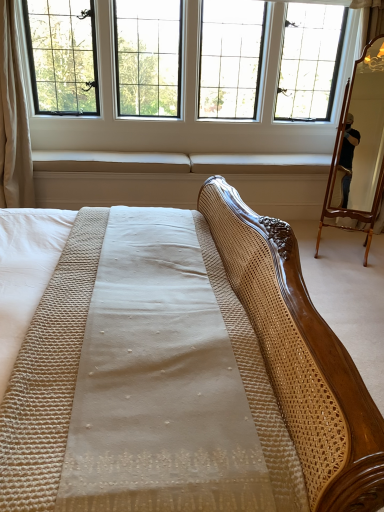
Where is `clear glass window at upper center`? Image resolution: width=384 pixels, height=512 pixels. clear glass window at upper center is located at coordinates (249, 68).

You are a GUI agent. You are given a task and a screenshot of the screen. Output one action in this format:
    pyautogui.click(x=<x>, y=<y>)
    Task: Click on the clear glass window at upper center
    
    Given the screenshot: What is the action you would take?
    pyautogui.click(x=249, y=68)

Consider the image. In terms of height, does white fabric curtain at left look taller or shorter compared to clear glass window at upper center?

white fabric curtain at left is taller than clear glass window at upper center.

From a real-world perspective, is white fabric curtain at left on clear glass window at upper center?

No, from a real-world perspective, white fabric curtain at left is not on top of clear glass window at upper center.

Does white fabric curtain at left have a greater width compared to clear glass window at upper center?

No, white fabric curtain at left is not wider than clear glass window at upper center.

Can you tell me how much white fabric curtain at left and clear glass window at upper center differ in facing direction?

white fabric curtain at left and clear glass window at upper center are facing 0.506 degrees away from each other.

Based on the photo, between wooden mirror at right and clear glass window at upper center, which one has less height?

Standing shorter between the two is clear glass window at upper center.

Who is bigger, wooden mirror at right or clear glass window at upper center?

Bigger between the two is clear glass window at upper center.

What's the angular difference between wooden mirror at right and clear glass window at upper center's facing directions?

The angle between the facing direction of wooden mirror at right and the facing direction of clear glass window at upper center is 25.1 degrees.

Based on the photo, could clear glass window at upper center be considered to be inside wooden mirror at right?

That's incorrect, clear glass window at upper center is not inside wooden mirror at right.

Where is `mirror in front of the white fabric curtain at left`? Image resolution: width=384 pixels, height=512 pixels. mirror in front of the white fabric curtain at left is located at coordinates (360, 146).

In terms of width, does wooden mirror at right look wider or thinner when compared to white fabric curtain at left?

Clearly, wooden mirror at right has less width compared to white fabric curtain at left.

Is wooden mirror at right bigger than white fabric curtain at left?

Actually, wooden mirror at right might be smaller than white fabric curtain at left.

Between point (331, 164) and point (13, 88), which one is positioned behind?

The point (331, 164) is farther from the camera.

Is clear glass window at upper center oriented towards white fabric curtain at left?

Yes, clear glass window at upper center is facing white fabric curtain at left.

Considering the points (247, 32) and (17, 197), which point is behind, point (247, 32) or point (17, 197)?

The point (247, 32) is behind.

Find the location of `curtain located underneath the clear glass window at upper center (from a real-world perspective)`. curtain located underneath the clear glass window at upper center (from a real-world perspective) is located at coordinates (13, 119).

Is clear glass window at upper center to the left or to the right of white fabric curtain at left in the image?

Clearly, clear glass window at upper center is on the right of white fabric curtain at left in the image.

Identify the location of mirror on the right of clear glass window at upper center. (360, 146).

Considering the sizes of objects clear glass window at upper center and wooden mirror at right in the image provided, who is bigger, clear glass window at upper center or wooden mirror at right?

Bigger between the two is clear glass window at upper center.

Who is taller, clear glass window at upper center or wooden mirror at right?

Standing taller between the two is wooden mirror at right.

Between point (14, 110) and point (378, 42), which one is positioned in front?

The point (378, 42) is closer.

Is the surface of white fabric curtain at left in direct contact with wooden mirror at right?

No, white fabric curtain at left is not with wooden mirror at right.

From a real-world perspective, which object rests below the other?

From a 3D spatial view, wooden mirror at right is below.

Consider the image. Could you tell me if white fabric curtain at left is turned towards wooden mirror at right?

No, white fabric curtain at left is not turned towards wooden mirror at right.

The height and width of the screenshot is (512, 384). Identify the location of curtain below the clear glass window at upper center (from a real-world perspective). (13, 119).

Identify the location of mirror in front of the clear glass window at upper center. (360, 146).

Considering their positions, is wooden mirror at right positioned closer to white fabric curtain at left than clear glass window at upper center?

clear glass window at upper center is closer to white fabric curtain at left.

Looking at the image, which one is located closer to clear glass window at upper center, wooden mirror at right or white fabric curtain at left?

Based on the image, white fabric curtain at left appears to be nearer to clear glass window at upper center.

Which object lies further to the anchor point clear glass window at upper center, white fabric curtain at left or wooden mirror at right?

wooden mirror at right.

Which object lies further to the anchor point wooden mirror at right, white fabric curtain at left or clear glass window at upper center?

white fabric curtain at left is further to wooden mirror at right.

Based on their spatial positions, is clear glass window at upper center or white fabric curtain at left further from wooden mirror at right?

Based on the image, white fabric curtain at left appears to be further to wooden mirror at right.

Estimate the real-world distances between objects in this image. Which object is further from white fabric curtain at left, clear glass window at upper center or wooden mirror at right?

Among the two, wooden mirror at right is located further to white fabric curtain at left.

Find the location of a particular element. The image size is (384, 512). window situated between white fabric curtain at left and wooden mirror at right from left to right is located at coordinates (249, 68).